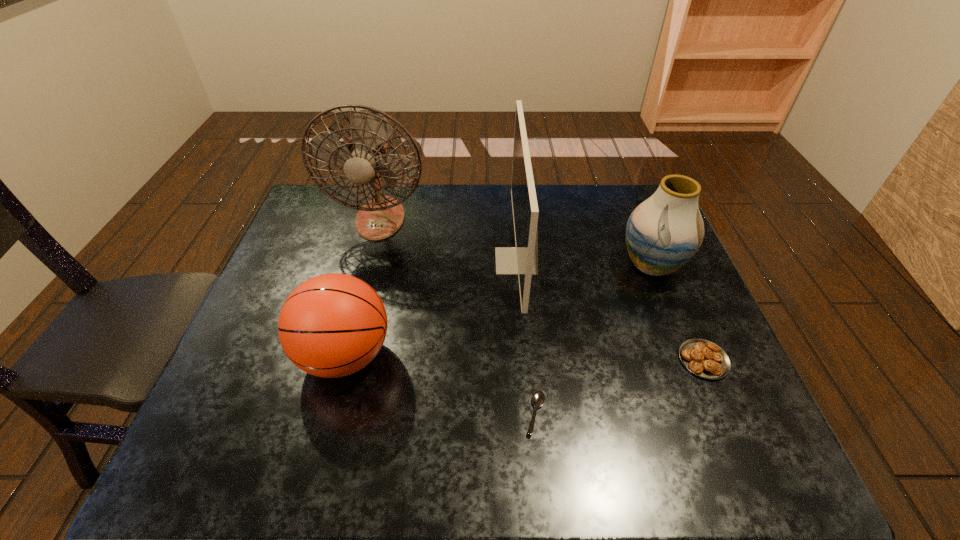
You are a GUI agent. You are given a task and a screenshot of the screen. Output one action in this format:
    pyautogui.click(x=<x>, y=<y>)
    Task: Click on the free point that satisfies the following two spatial constraints: 1. on the front side of the soupspoon; 2. on the right side of the third shortest object
    This screenshot has height=540, width=960.
    Given the screenshot: What is the action you would take?
    pyautogui.click(x=330, y=414)

What are the coordinates of `vacant space that satisfies the following two spatial constraints: 1. on the front side of the shortest object; 2. on the right side of the basketball` in the screenshot? It's located at click(x=330, y=414).

Locate an element on the screen. free space in the image that satisfies the following two spatial constraints: 1. in front of the third tallest object to direct airflow; 2. on the left side of the fan is located at coordinates (368, 265).

Identify the location of free space that satisfies the following two spatial constraints: 1. on the front-facing side of the shortest object; 2. on the right side of the monitor. (529, 414).

This screenshot has width=960, height=540. What are the coordinates of `free spot that satisfies the following two spatial constraints: 1. in front of the fan to direct airflow; 2. on the right side of the third tallest object` in the screenshot? It's located at (368, 265).

Locate an element on the screen. vacant space that satisfies the following two spatial constraints: 1. in front of the fan to direct airflow; 2. on the left side of the shortest object is located at coordinates (329, 414).

Where is `vacant position in the image that satisfies the following two spatial constraints: 1. in front of the third tallest object to direct airflow; 2. on the right side of the fan`? The width and height of the screenshot is (960, 540). vacant position in the image that satisfies the following two spatial constraints: 1. in front of the third tallest object to direct airflow; 2. on the right side of the fan is located at coordinates (368, 265).